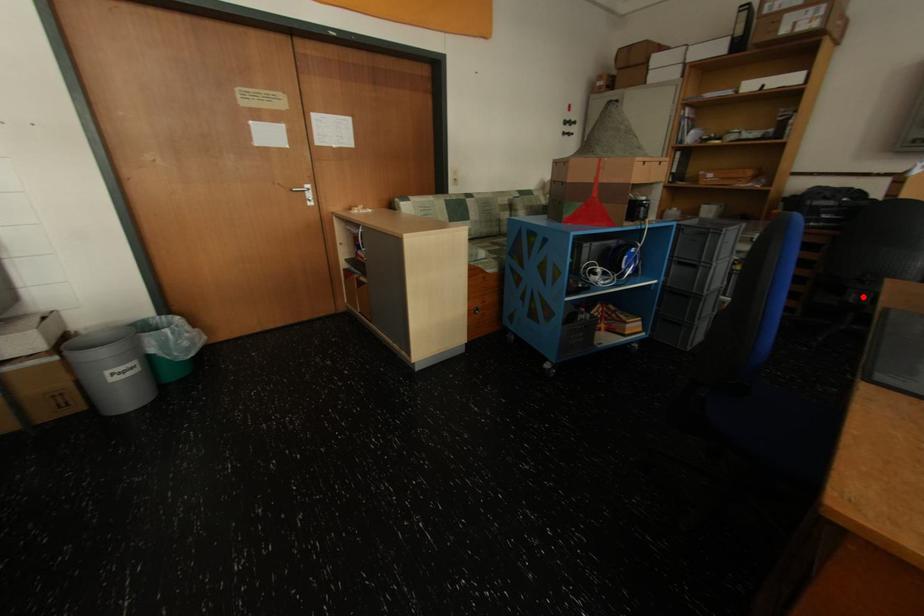
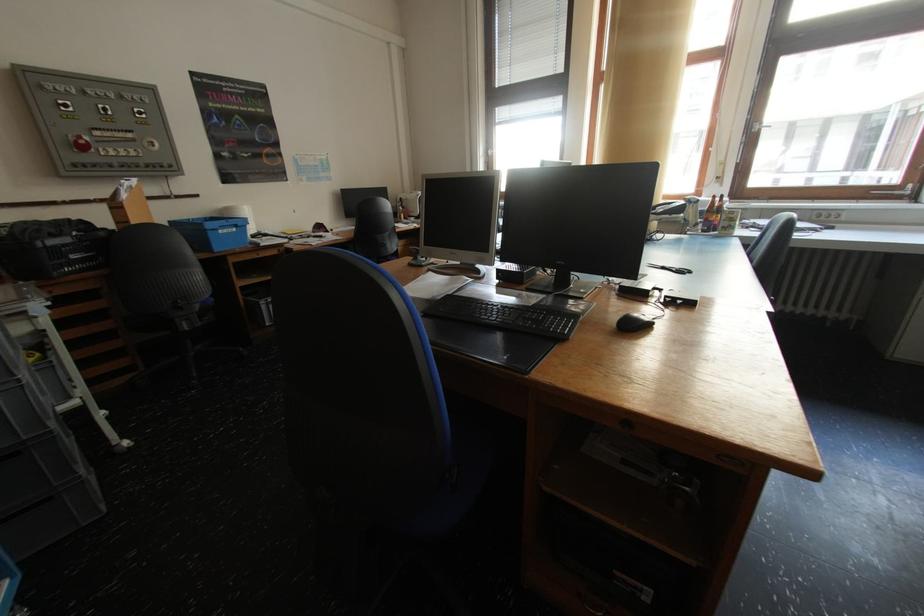
Find the pixel in the second image that matches the highlighted location in the first image.

(192, 323)